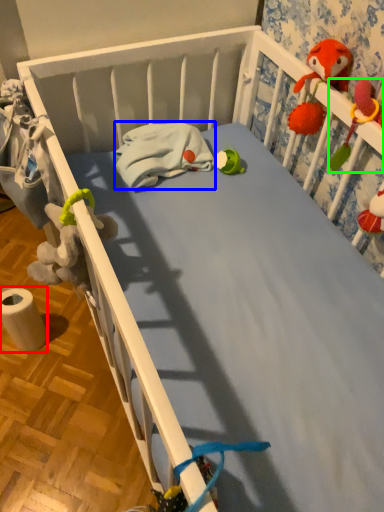
Question: Based on their relative distances, which object is farther from toilet paper (highlighted by a red box)? Choose from material (highlighted by a blue box) and toy (highlighted by a green box).

Choices:
 (A) material
 (B) toy

Answer: (B)